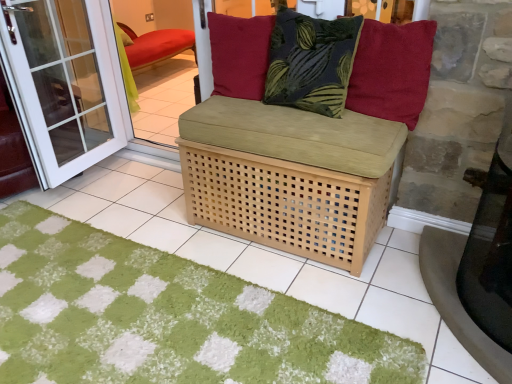
Locate an element on the screen. The image size is (512, 384). white glass screen door at left is located at coordinates (62, 83).

This screenshot has width=512, height=384. In order to click on velvet red cushion at upper center, arranged as the 3th pillow when viewed from the left in this screenshot , I will do `click(392, 71)`.

What do you see at coordinates (240, 54) in the screenshot?
I see `red velvet cushion at upper center, the third pillow viewed from the right` at bounding box center [240, 54].

The width and height of the screenshot is (512, 384). What are the coordinates of `white glass screen door at left` in the screenshot? It's located at (62, 83).

From the picture: Considering the positions of objects velvet red cushion at upper center, arranged as the 3th pillow when viewed from the left, and green shaggy doormat at center in the image provided, who is more to the right, velvet red cushion at upper center, arranged as the 3th pillow when viewed from the left, or green shaggy doormat at center?

velvet red cushion at upper center, arranged as the 3th pillow when viewed from the left, is more to the right.

Is velvet red cushion at upper center, arranged as the 3th pillow when viewed from the left, spatially inside green shaggy doormat at center, or outside of it?

velvet red cushion at upper center, arranged as the 3th pillow when viewed from the left, exists outside the volume of green shaggy doormat at center.

From a real-world perspective, is velvet red cushion at upper center, the first pillow positioned from the right, on top of green shaggy doormat at center?

Yes, from a real-world perspective, velvet red cushion at upper center, the first pillow positioned from the right, is over green shaggy doormat at center

Which of these two, velvet red cushion at upper center, arranged as the 3th pillow when viewed from the left, or green shaggy doormat at center, is bigger?

With larger size is green shaggy doormat at center.

Is green shaggy doormat at center positioned beyond the bounds of smooth concrete table at lower right?

green shaggy doormat at center is positioned outside smooth concrete table at lower right.

Which point is more distant from viewer, (72, 367) or (501, 247)?

Point (72, 367)

Which object is more forward, green shaggy doormat at center or smooth concrete table at lower right?

green shaggy doormat at center is more forward.

Is smooth concrete table at lower right at the back of green shaggy doormat at center?

That's not correct — green shaggy doormat at center is not looking away from smooth concrete table at lower right.

Considering the positions of objects smooth concrete table at lower right and natural wood basket at center in the image provided, who is more to the right, smooth concrete table at lower right or natural wood basket at center?

Positioned to the right is smooth concrete table at lower right.

Locate an element on the screen. The height and width of the screenshot is (384, 512). table that appears on the right of natural wood basket at center is located at coordinates (490, 251).

Who is smaller, smooth concrete table at lower right or natural wood basket at center?

With smaller size is smooth concrete table at lower right.

Does smooth concrete table at lower right turn towards natural wood basket at center?

No, smooth concrete table at lower right does not turn towards natural wood basket at center.

Is green shaggy doormat at center further to the viewer compared to white glass screen door at left?

That is False.

How different are the orientations of green shaggy doormat at center and white glass screen door at left in degrees?

green shaggy doormat at center and white glass screen door at left are facing 89 degrees away from each other.

Is green shaggy doormat at center taller or shorter than white glass screen door at left?

Considering their sizes, green shaggy doormat at center has less height than white glass screen door at left.

From the image's perspective, is natural wood basket at center beneath velvet red cushion at upper center, the first pillow positioned from the right?

Yes, from the image's perspective, natural wood basket at center is below velvet red cushion at upper center, the first pillow positioned from the right.

Does natural wood basket at center have a larger size compared to velvet red cushion at upper center, the first pillow positioned from the right?

Correct, natural wood basket at center is larger in size than velvet red cushion at upper center, the first pillow positioned from the right.

Considering the positions of objects natural wood basket at center and velvet red cushion at upper center, the first pillow positioned from the right, in the image provided, who is more to the left, natural wood basket at center or velvet red cushion at upper center, the first pillow positioned from the right,?

From the viewer's perspective, natural wood basket at center appears more on the left side.

Between natural wood basket at center and velvet red cushion at upper center, arranged as the 3th pillow when viewed from the left, which one has more height?

natural wood basket at center is taller.

Measure the distance between white glass screen door at left and velvet red cushion at upper center, the first pillow positioned from the right.

They are 5.87 feet apart.

Would you consider white glass screen door at left to be distant from velvet red cushion at upper center, arranged as the 3th pillow when viewed from the left?

Yes, white glass screen door at left and velvet red cushion at upper center, arranged as the 3th pillow when viewed from the left, are located far from each other.

Identify the location of pillow that is the 2nd one when counting forward from the white glass screen door at left. The height and width of the screenshot is (384, 512). (392, 71).

Is point (14, 13) less distant than point (411, 41)?

No, (14, 13) is further to viewer.

Does natural wood basket at center appear on the right side of dark green textured pillow at center, arranged as the second pillow when viewed from the right?

In fact, natural wood basket at center is to the left of dark green textured pillow at center, arranged as the second pillow when viewed from the right.

How many degrees apart are the facing directions of natural wood basket at center and dark green textured pillow at center, placed as the second pillow when sorted from left to right?

0.00212 degrees.

Consider the image. Who is taller, natural wood basket at center or dark green textured pillow at center, placed as the second pillow when sorted from left to right?

With more height is natural wood basket at center.

Is natural wood basket at center positioned beyond the bounds of dark green textured pillow at center, placed as the second pillow when sorted from left to right?

Yes, natural wood basket at center is located beyond the bounds of dark green textured pillow at center, placed as the second pillow when sorted from left to right.

Where is `the 3rd pillow to the right of the green shaggy doormat at center, starting your count from the anchor`? the 3rd pillow to the right of the green shaggy doormat at center, starting your count from the anchor is located at coordinates (392, 71).

Find the location of `table above the green shaggy doormat at center (from the image's perspective)`. table above the green shaggy doormat at center (from the image's perspective) is located at coordinates (490, 251).

Based on their spatial positions, is dark green textured pillow at center, arranged as the second pillow when viewed from the right, or green shaggy doormat at center closer to red velvet cushion at upper center, which is the first pillow from left to right?

The object closer to red velvet cushion at upper center, which is the first pillow from left to right, is dark green textured pillow at center, arranged as the second pillow when viewed from the right.

Estimate the real-world distances between objects in this image. Which object is closer to red velvet cushion at upper center, the third pillow viewed from the right, velvet red cushion at upper center, the first pillow positioned from the right, or white glass screen door at left?

The object closer to red velvet cushion at upper center, the third pillow viewed from the right, is velvet red cushion at upper center, the first pillow positioned from the right.

Looking at the image, which one is located further to smooth concrete table at lower right, green shaggy doormat at center or natural wood basket at center?

The object further to smooth concrete table at lower right is green shaggy doormat at center.

From the image, which object appears to be nearer to dark green textured pillow at center, placed as the second pillow when sorted from left to right, velvet red cushion at upper center, arranged as the 3th pillow when viewed from the left, or natural wood basket at center?

velvet red cushion at upper center, arranged as the 3th pillow when viewed from the left, is closer to dark green textured pillow at center, placed as the second pillow when sorted from left to right.

From the image, which object appears to be nearer to dark green textured pillow at center, placed as the second pillow when sorted from left to right, velvet red cushion at upper center, arranged as the 3th pillow when viewed from the left, or red velvet cushion at upper center, the third pillow viewed from the right?

velvet red cushion at upper center, arranged as the 3th pillow when viewed from the left, is closer to dark green textured pillow at center, placed as the second pillow when sorted from left to right.

In the scene shown: Which object lies nearer to the anchor point smooth concrete table at lower right, green shaggy doormat at center or velvet red cushion at upper center, arranged as the 3th pillow when viewed from the left?

Based on the image, velvet red cushion at upper center, arranged as the 3th pillow when viewed from the left, appears to be nearer to smooth concrete table at lower right.

Which object lies nearer to the anchor point green shaggy doormat at center, white glass screen door at left or red velvet cushion at upper center, the third pillow viewed from the right?

Among the two, red velvet cushion at upper center, the third pillow viewed from the right, is located nearer to green shaggy doormat at center.

Looking at the image, which one is located further to natural wood basket at center, smooth concrete table at lower right or green shaggy doormat at center?

smooth concrete table at lower right.

The image size is (512, 384). What are the coordinates of `basket between white glass screen door at left and dark green textured pillow at center, arranged as the second pillow when viewed from the right, in the horizontal direction` in the screenshot? It's located at (285, 203).

The image size is (512, 384). I want to click on basket between red velvet cushion at upper center, which is the first pillow from left to right, and velvet red cushion at upper center, the first pillow positioned from the right, from left to right, so click(285, 203).

You are a GUI agent. You are given a task and a screenshot of the screen. Output one action in this format:
    pyautogui.click(x=<x>, y=<y>)
    Task: Click on the basket between red velvet cushion at upper center, which is the first pillow from left to right, and smooth concrete table at lower right, in the horizontal direction
    The image size is (512, 384).
    Given the screenshot: What is the action you would take?
    pyautogui.click(x=285, y=203)

You are a GUI agent. You are given a task and a screenshot of the screen. Output one action in this format:
    pyautogui.click(x=<x>, y=<y>)
    Task: Click on the pillow between white glass screen door at left and natural wood basket at center
    The height and width of the screenshot is (384, 512).
    Given the screenshot: What is the action you would take?
    pyautogui.click(x=240, y=54)